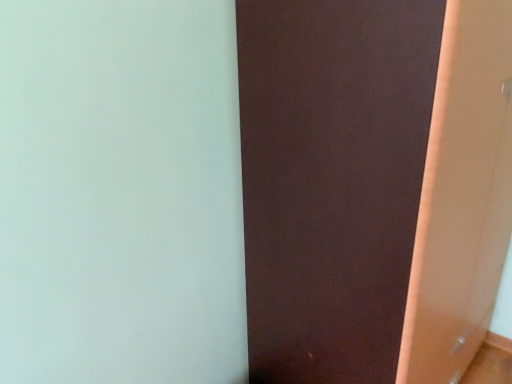
Measure the distance between point (376, 366) and camera.

The depth of point (376, 366) is 1.14 meters.

This screenshot has height=384, width=512. What do you see at coordinates (332, 180) in the screenshot? I see `dark brown wood door at center` at bounding box center [332, 180].

Locate an element on the screen. This screenshot has width=512, height=384. dark brown wood door at center is located at coordinates (332, 180).

Locate an element on the screen. The height and width of the screenshot is (384, 512). dark brown wood door at center is located at coordinates (332, 180).